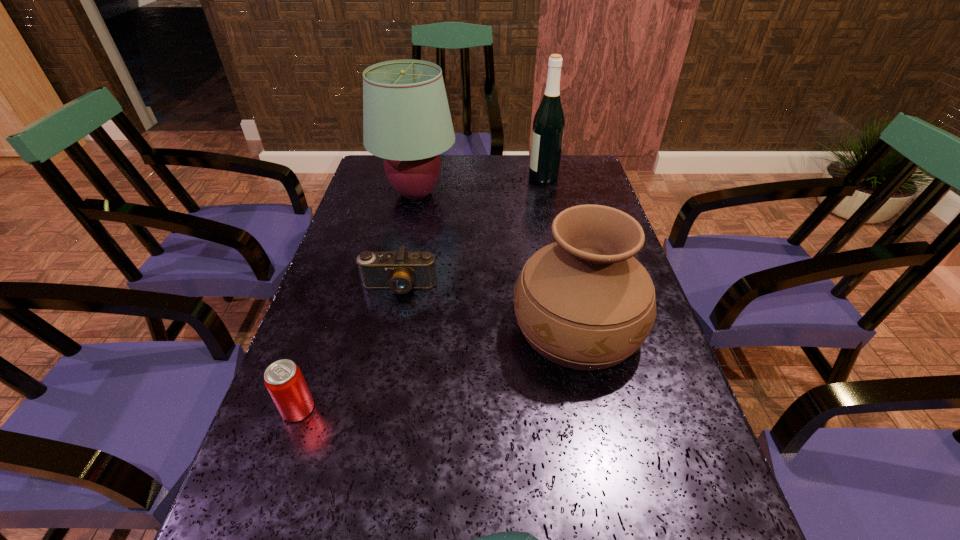
Locate an element on the screen. Image resolution: width=960 pixels, height=540 pixels. vacant space that's between the urn and the fifth farthest object is located at coordinates (438, 368).

Where is `object that stands as the second closest to the camera`? This screenshot has width=960, height=540. object that stands as the second closest to the camera is located at coordinates (406, 118).

Locate an element on the screen. the closest object to the urn is located at coordinates (401, 271).

Where is `blank area in the image that satisfies the following two spatial constraints: 1. on the label of the wine bottle; 2. on the lens of the camera`? The width and height of the screenshot is (960, 540). blank area in the image that satisfies the following two spatial constraints: 1. on the label of the wine bottle; 2. on the lens of the camera is located at coordinates (566, 286).

Image resolution: width=960 pixels, height=540 pixels. In order to click on free space that satisfies the following two spatial constraints: 1. on the label of the wine bottle; 2. on the lens of the camera in this screenshot , I will do `click(566, 286)`.

The image size is (960, 540). Identify the location of free region that satisfies the following two spatial constraints: 1. on the lens of the urn; 2. on the left side of the camera. (391, 327).